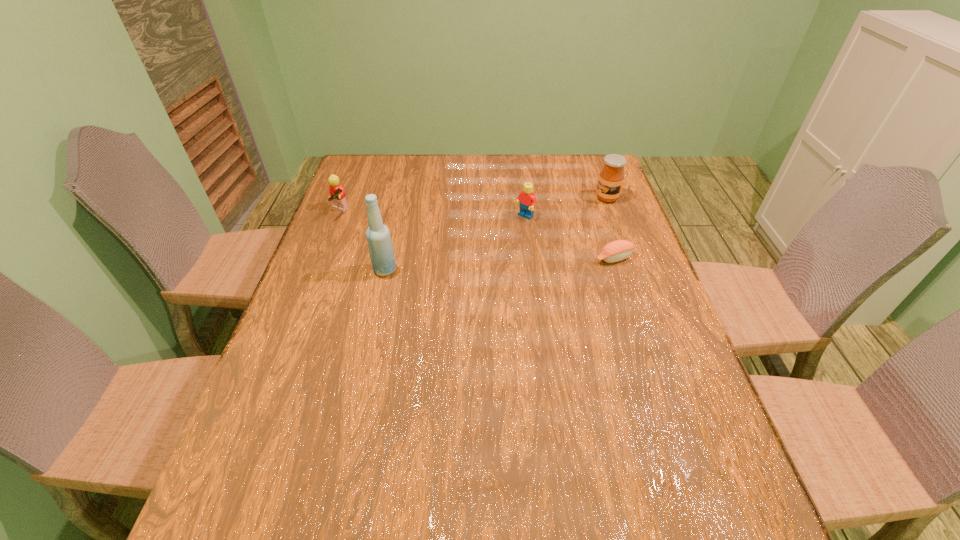
The width and height of the screenshot is (960, 540). I want to click on free space between the honey and the leftmost object, so click(473, 205).

This screenshot has height=540, width=960. I want to click on vacant area between the fourth shortest object and the shortest object, so click(611, 228).

Locate an element on the screen. This screenshot has width=960, height=540. free spot between the left Lego and the honey is located at coordinates (473, 205).

Identify the location of free space between the fourth shortest object and the bottle. (496, 234).

Find the location of a particular element. Image resolution: width=960 pixels, height=540 pixels. free space between the shortest object and the honey is located at coordinates (611, 228).

At what (x,y) coordinates should I click in order to perform the action: click on unoccupied area between the third object from right to left and the fourth shortest object. Please return your answer as a coordinate pair (x, y). Looking at the image, I should click on (565, 207).

Identify the location of object that stands as the closest to the shortest object. This screenshot has width=960, height=540. (527, 199).

The height and width of the screenshot is (540, 960). Find the location of `the closest object to the bottle`. the closest object to the bottle is located at coordinates (337, 194).